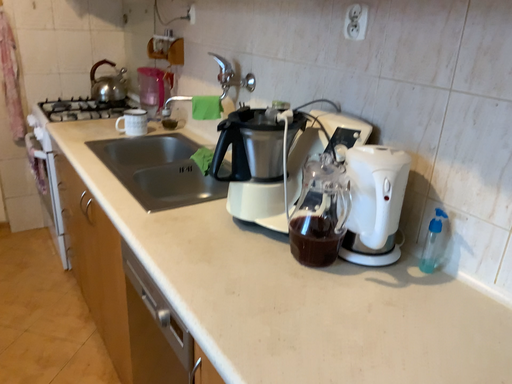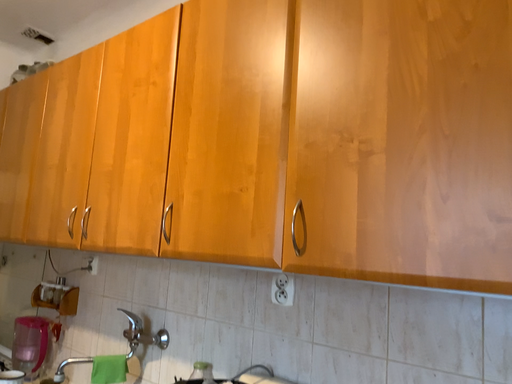
Question: Which way did the camera rotate in the video?

Choices:
 (A) rotated left
 (B) rotated right

Answer: (B)